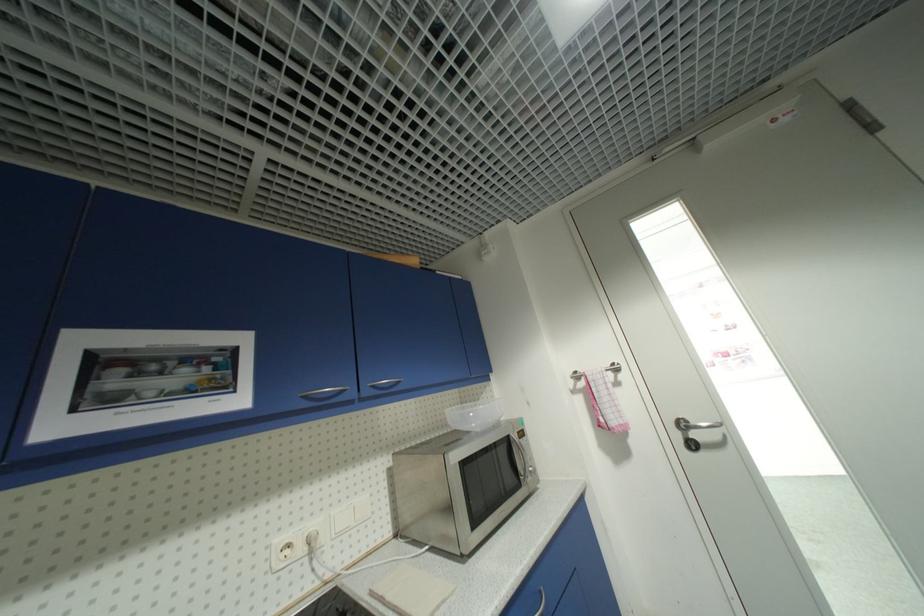
What do you see at coordinates (411, 591) in the screenshot? I see `the white notepad` at bounding box center [411, 591].